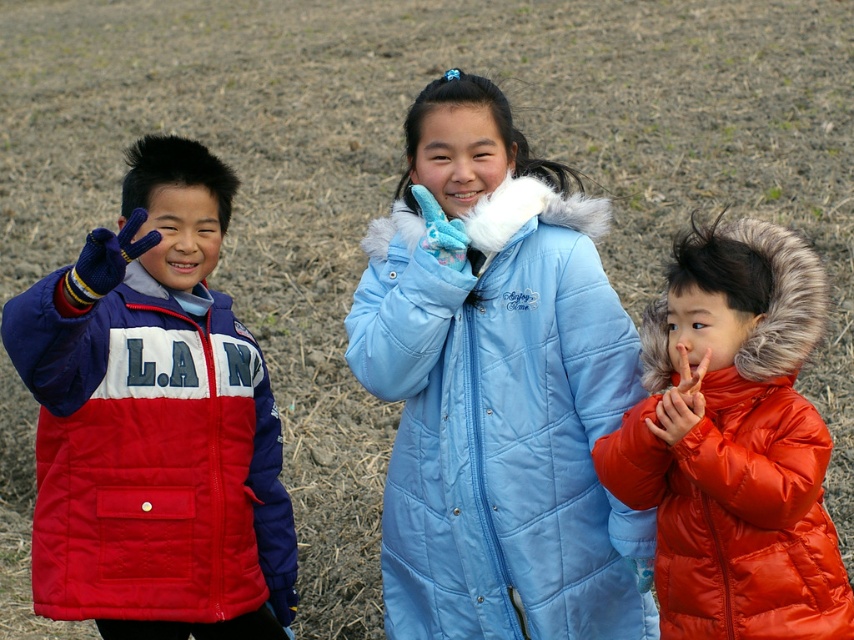
Question: Is matte nylon jacket at left smaller than matte orange glove at lower right?

Choices:
 (A) no
 (B) yes

Answer: (A)

Question: Can you confirm if light blue quilted jacket at center is bigger than shiny orange puffer jacket at right?

Choices:
 (A) yes
 (B) no

Answer: (A)

Question: Which object is the closest to the matte nylon jacket at left?

Choices:
 (A) light blue quilted jacket at center
 (B) matte orange glove at lower right

Answer: (A)

Question: Considering the relative positions of light blue quilted jacket at center and matte orange glove at lower right in the image provided, where is light blue quilted jacket at center located with respect to matte orange glove at lower right?

Choices:
 (A) below
 (B) above

Answer: (A)

Question: Which object appears farthest from the camera in this image?

Choices:
 (A) matte orange glove at lower right
 (B) light blue quilted jacket at center

Answer: (B)

Question: Among these objects, which one is nearest to the camera?

Choices:
 (A) matte orange glove at lower right
 (B) shiny orange puffer jacket at right
 (C) matte nylon jacket at left

Answer: (C)